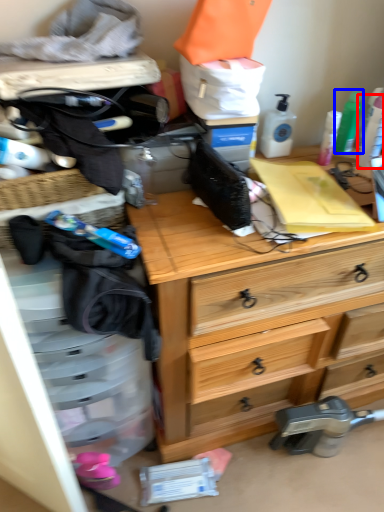
Question: Which of the following is the closest to the observer, toiletry (highlighted by a red box) or toiletry (highlighted by a blue box)?

Choices:
 (A) toiletry
 (B) toiletry

Answer: (A)